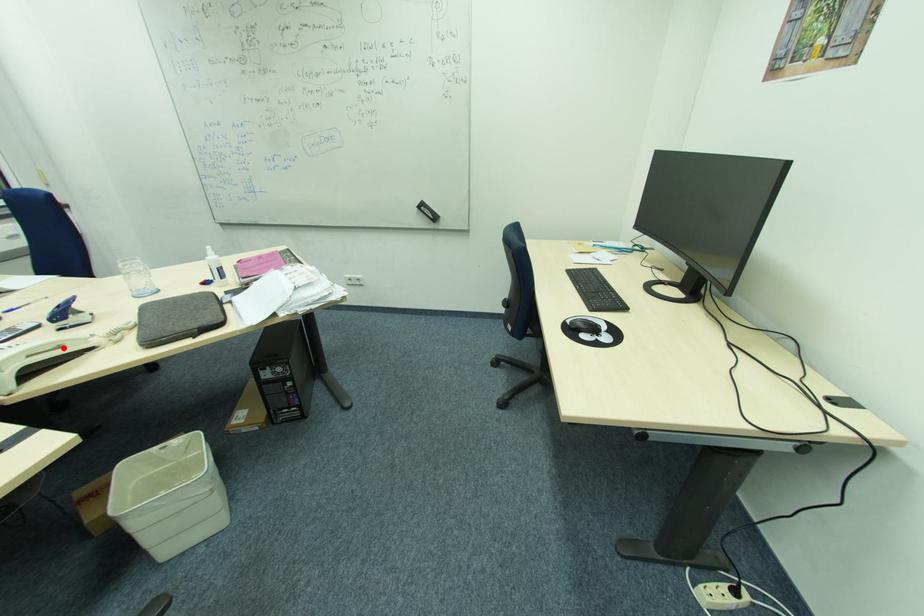
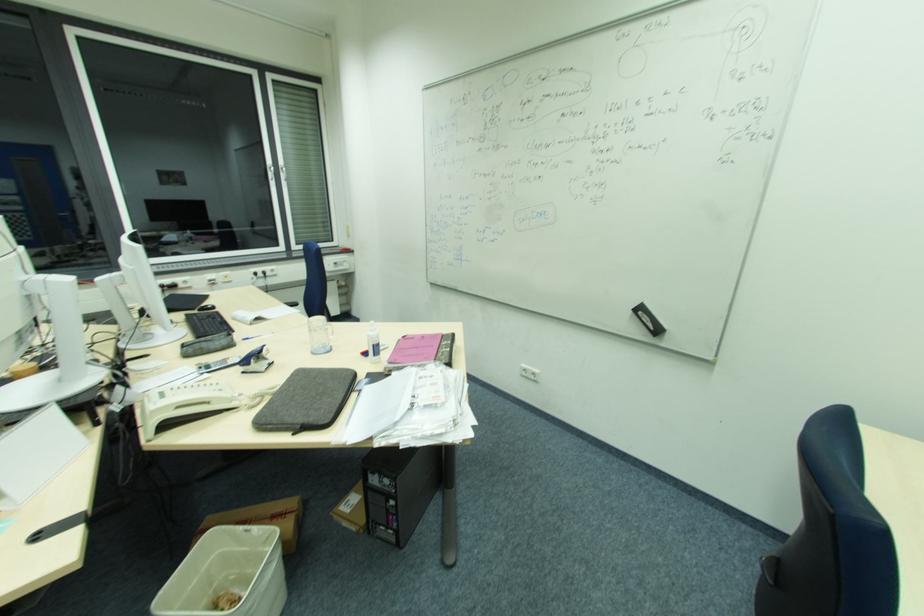
Find the pixel in the second image that matches the highlighted location in the first image.

(210, 403)